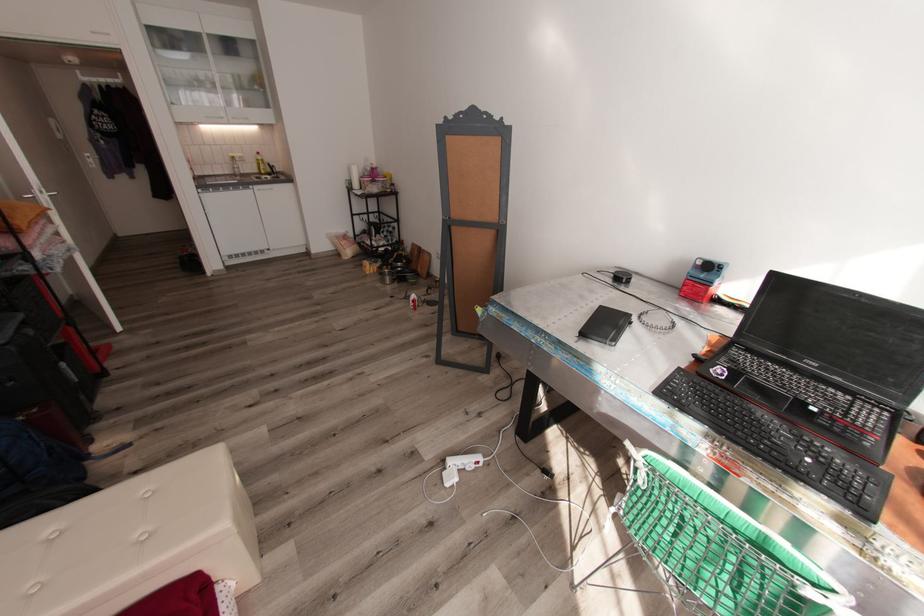
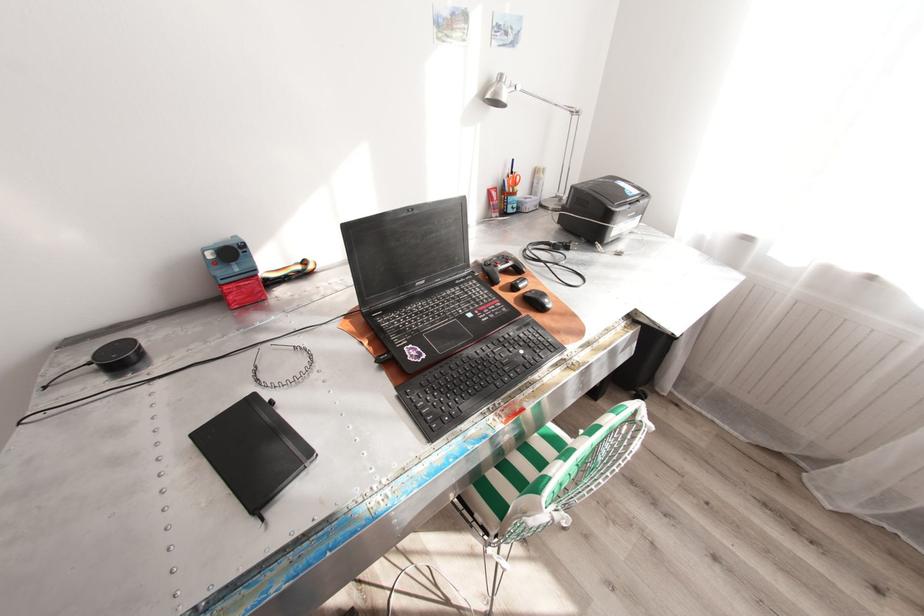
Where in the second image is the point corresponding to the point at 618,341 from the first image?

(314, 452)